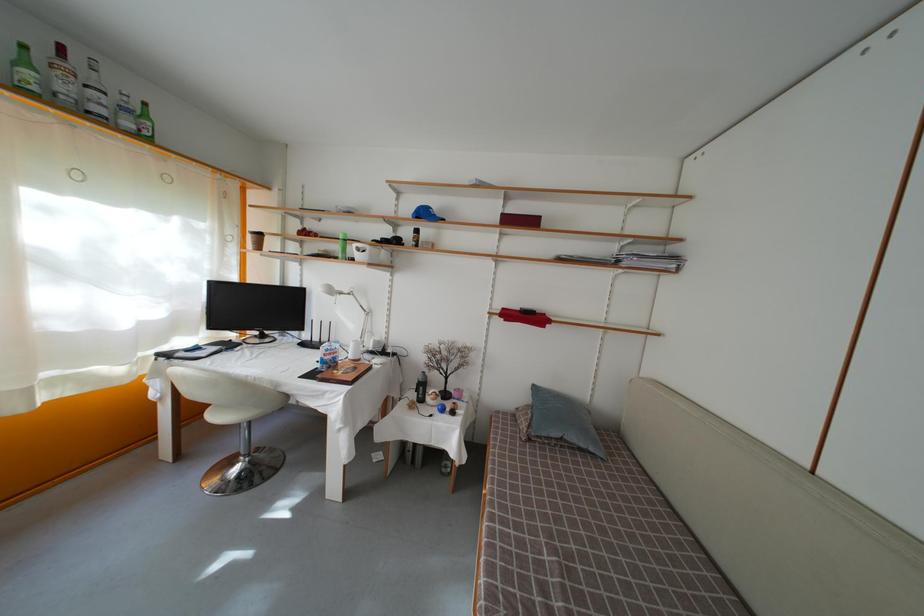
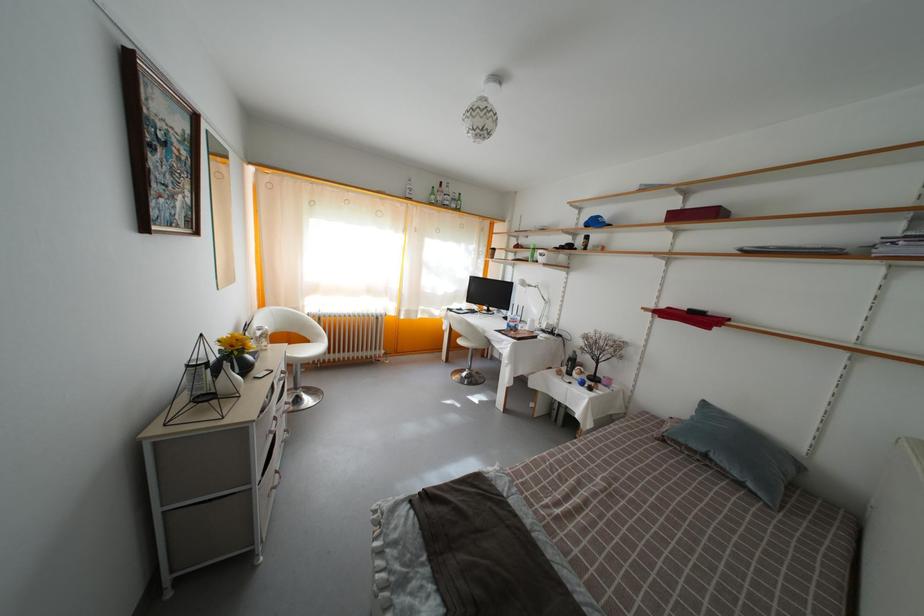
Where in the second image is the point corresponding to [589,452] from the first image?

(743, 482)